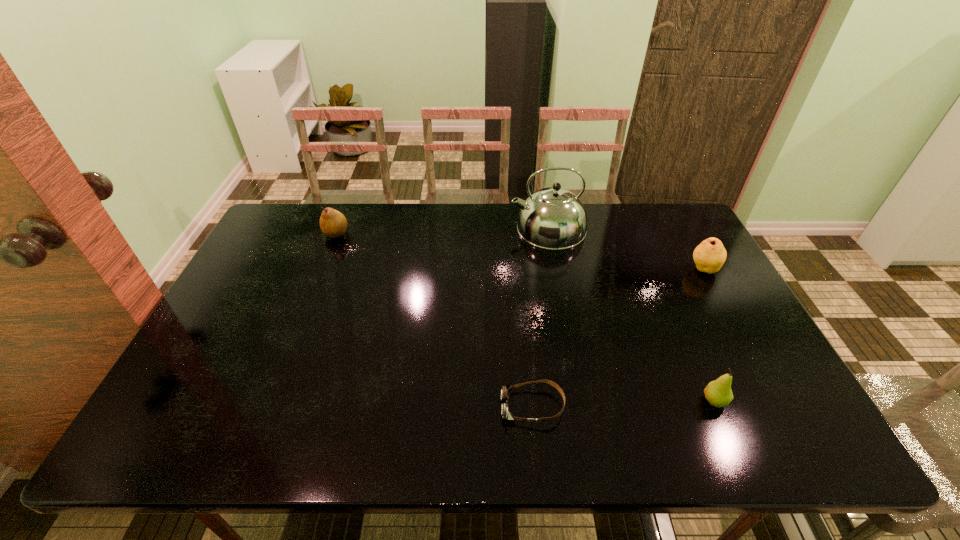
In order to click on vacant space that satisfies the following two spatial constraints: 1. from the spout of the tallest object; 2. on the back side of the rightmost pear in this screenshot , I will do `click(556, 269)`.

This screenshot has height=540, width=960. I want to click on vacant area that satisfies the following two spatial constraints: 1. from the spout of the tallest object; 2. on the right side of the second pear from right to left, so click(580, 401).

At what (x,y) coordinates should I click in order to perform the action: click on vacant area in the image that satisfies the following two spatial constraints: 1. from the spout of the tallest object; 2. on the back side of the rightmost pear. Please return your answer as a coordinate pair (x, y). This screenshot has height=540, width=960. Looking at the image, I should click on (556, 269).

Find the location of a particular element. Image resolution: width=960 pixels, height=540 pixels. free space that satisfies the following two spatial constraints: 1. from the spout of the kettle; 2. on the right side of the fourth object from left to right is located at coordinates (580, 401).